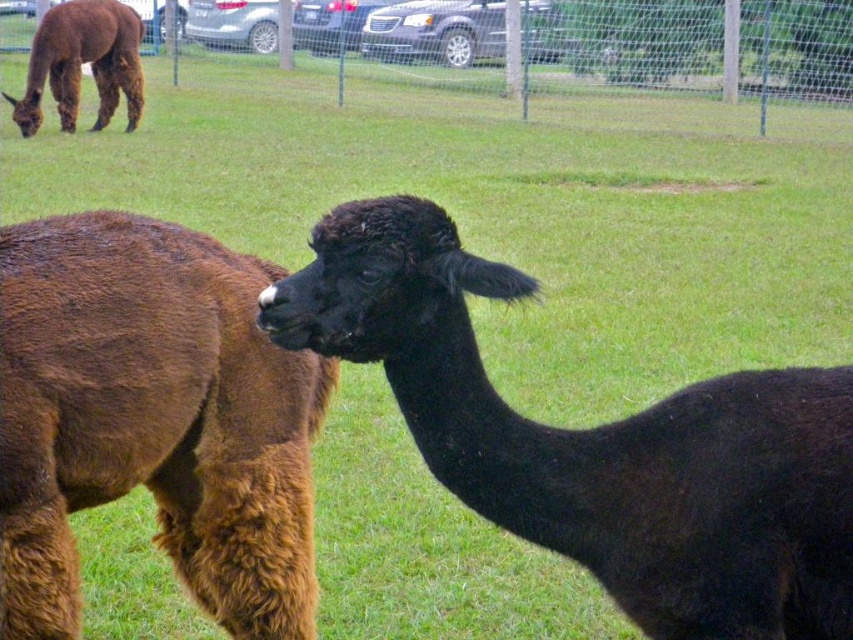
You are a photographer trying to capture both the black fuzzy alpaca at center and the fence at upper center in the same frame. Based on their sizes, which one would appear closer to the camera?

The black fuzzy alpaca at center has a smaller size compared to the fence at upper center, so it would appear closer to the camera since objects closer to the lens appear larger in the photo.

You are a photographer trying to capture both the brown fuzzy camel at left and the fence at upper center in the same frame. Based on their sizes, which object would appear smaller in the photo?

The brown fuzzy camel at left has a lesser width compared to the fence at upper center, so it would appear smaller in the photo.